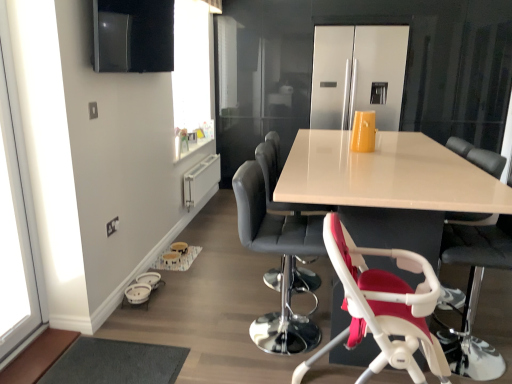
Locate an element on the screen. vacant area that lies between black leather bar stool at center, marked as the 2th chair in a back-to-front arrangement, and white plastic baby carriage at lower left is located at coordinates (205, 314).